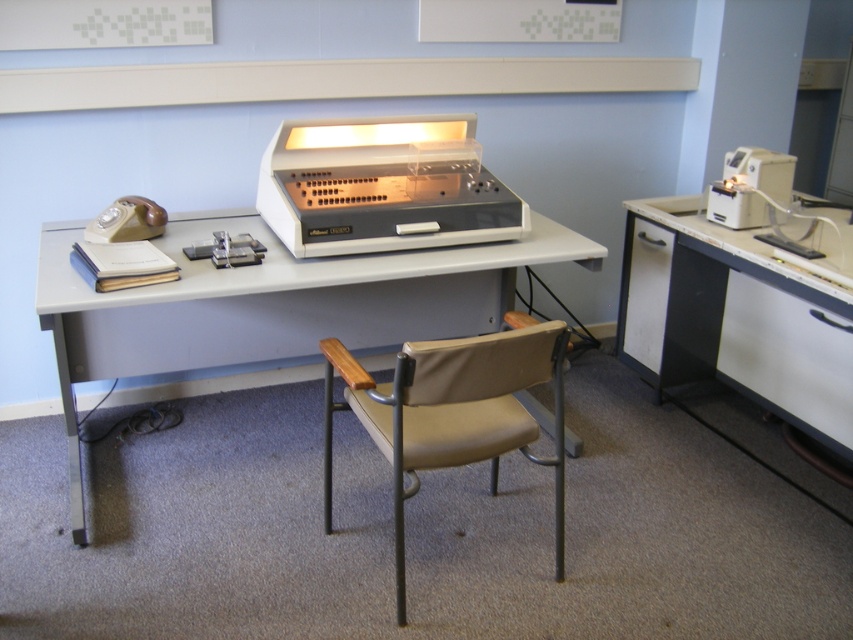
Looking at this image, who is positioned more to the right, white plastic register at center or beige fabric swivel chair at center?

beige fabric swivel chair at center is more to the right.

Is white plastic register at center to the right of beige fabric swivel chair at center from the viewer's perspective?

In fact, white plastic register at center is to the left of beige fabric swivel chair at center.

Identify the location of white plastic register at center. Image resolution: width=853 pixels, height=640 pixels. (381, 186).

In the scene shown: Does white plastic drawer at right have a lesser height compared to beige plastic telephone at left?

Incorrect, white plastic drawer at right's height does not fall short of beige plastic telephone at left's.

Which is behind, point (848, 452) or point (115, 209)?

The point (848, 452) is more distant.

At what (x,y) coordinates should I click in order to perform the action: click on white plastic drawer at right. Please return your answer as a coordinate pair (x, y). This screenshot has width=853, height=640. Looking at the image, I should click on click(788, 355).

Which is more to the right, white glossy computer desk at right or white plastic register at center?

white glossy computer desk at right

The image size is (853, 640). What do you see at coordinates (733, 320) in the screenshot? I see `white glossy computer desk at right` at bounding box center [733, 320].

Locate an element on the screen. This screenshot has height=640, width=853. white glossy computer desk at right is located at coordinates (733, 320).